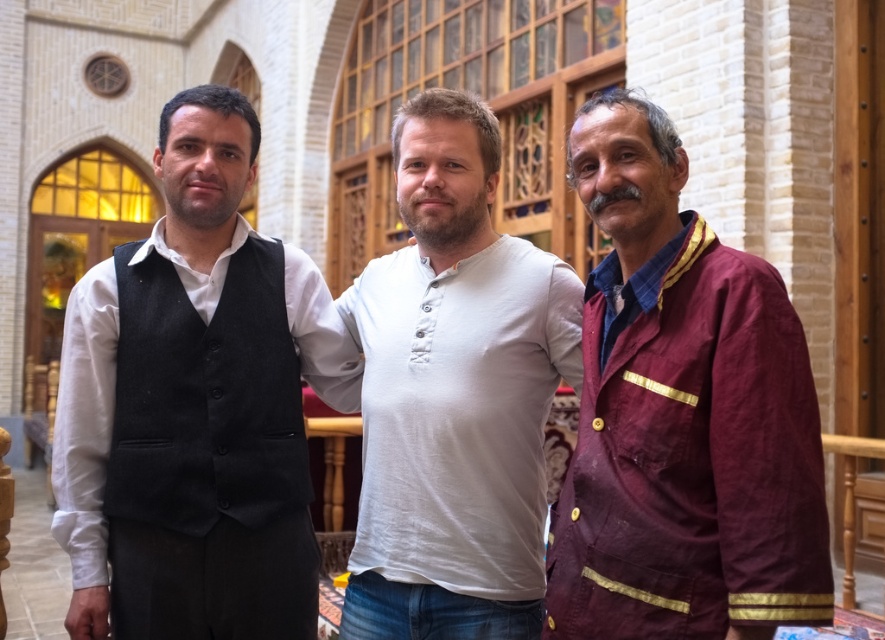
You are standing in the room depicted in the scene. There is a black wool vest at left located at point (x=195, y=406). If you want to reach this vest, which direction should you move relative to your current position?

The black wool vest at left is located at point (x=195, y=406), so you should move towards the left side of the room to reach it.

You are an interior designer analyzing the placement of items in the room. The black wool vest at left is positioned at coordinates 0.636 in the x and 0.221 in the y. Can you confirm if the vest is closer to the left wall or the right wall based on its coordinates?

The black wool vest at left is located at point (195, 406). Since the x coordinate is 0.636, which is closer to 1.0, the vest is closer to the right wall than the left wall. However, the label states it is at the left, so there might be a discrepancy. But strictly following coordinates, it leans right.

You are a tailor who needs to create a new vest for a client. You observe the black wool vest at left and the white cotton shirt at center in the image. Which garment should you choose as a reference for the vest if the client prefers a wider silhouette?

The black wool vest at left has a larger width than the white cotton shirt at center, so you should choose the black wool vest at left as the reference for a wider silhouette.